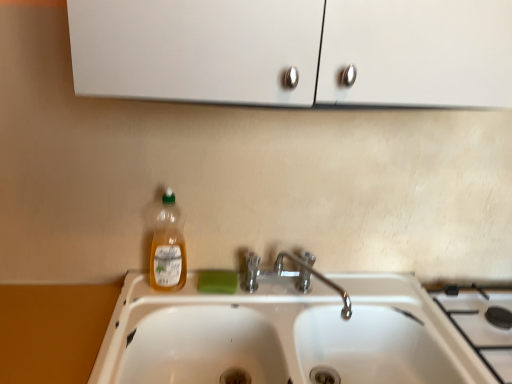
Identify the location of vacant area to the right of chrome metallic faucet at sink center. (384, 299).